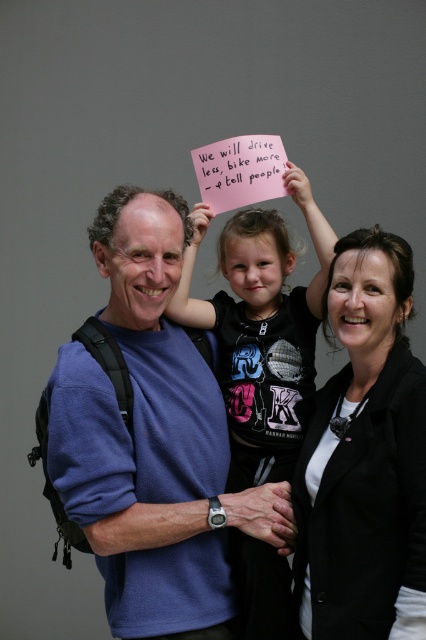
Question: From the image, what is the correct spatial relationship of blue fabric shirt at center in relation to black matte blazer at center?

Choices:
 (A) right
 (B) left

Answer: (B)

Question: Does blue fabric shirt at center appear on the right side of black matte blazer at center?

Choices:
 (A) yes
 (B) no

Answer: (B)

Question: Which point is farther to the camera?

Choices:
 (A) black matte blazer at center
 (B) black matte shirt at center
 (C) blue fabric shirt at center

Answer: (B)

Question: Based on their relative distances, which object is farther from the black matte blazer at center?

Choices:
 (A) blue fabric shirt at center
 (B) black matte shirt at center

Answer: (A)

Question: Which object is positioned closest to the black matte blazer at center?

Choices:
 (A) black matte shirt at center
 (B) blue fabric shirt at center

Answer: (A)

Question: Is blue fabric shirt at center smaller than black matte blazer at center?

Choices:
 (A) yes
 (B) no

Answer: (B)